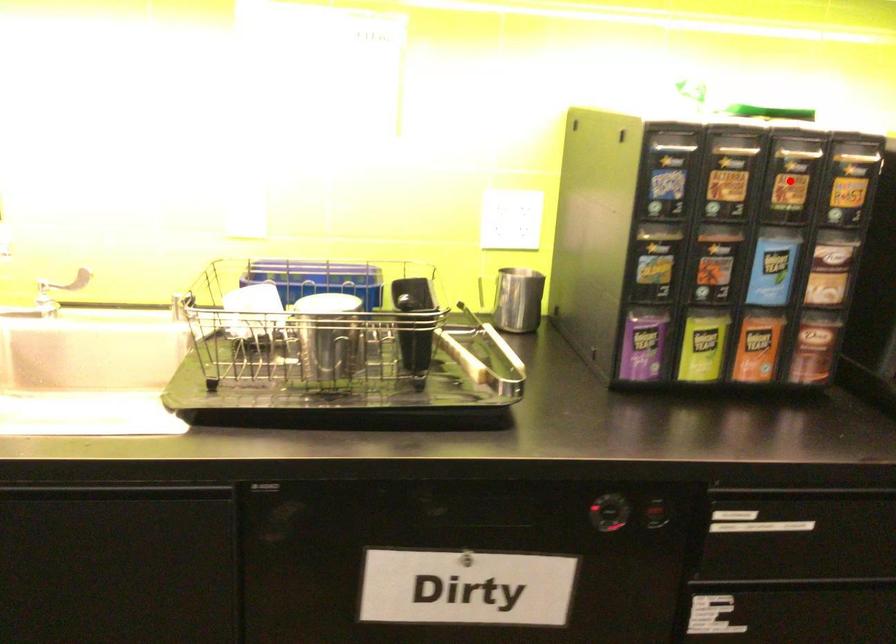
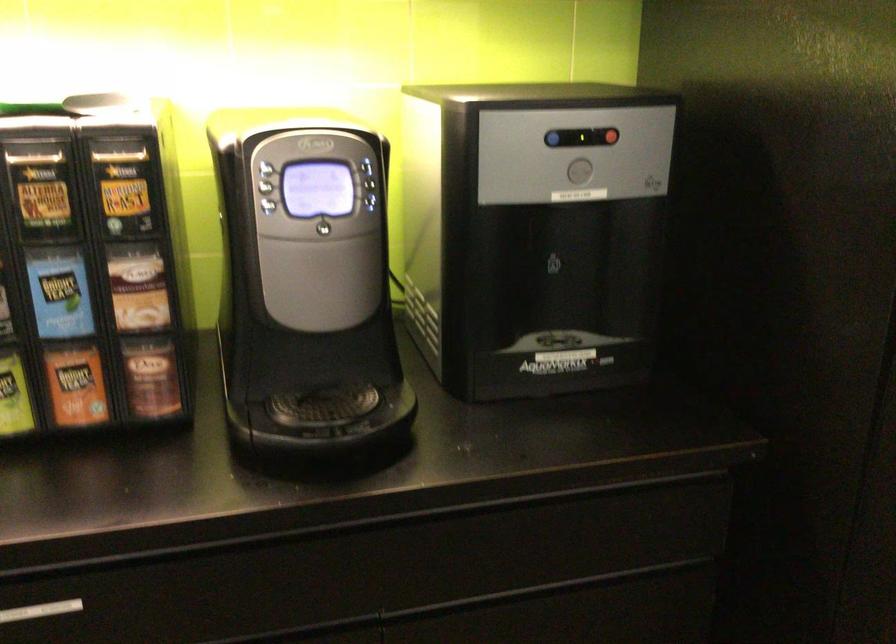
Locate, in the second image, the point that corresponds to the highlighted location in the first image.

(41, 191)